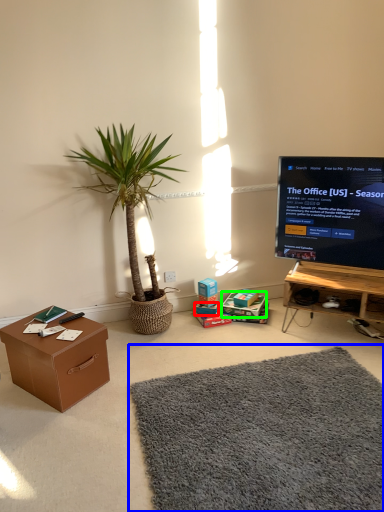
Question: Estimate the real-world distances between objects in this image. Which object is farther from box (highlighted by a red box), mat (highlighted by a blue box) or cardboard box (highlighted by a green box)?

Choices:
 (A) mat
 (B) cardboard box

Answer: (A)